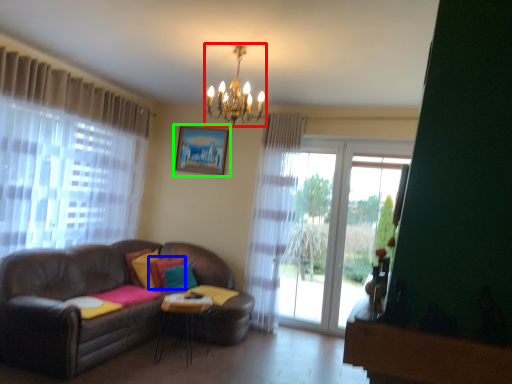
Question: Which object is positioned closest to light fixture (highlighted by a red box)? Select from pillow (highlighted by a blue box) and picture frame (highlighted by a green box).

Choices:
 (A) pillow
 (B) picture frame

Answer: (B)